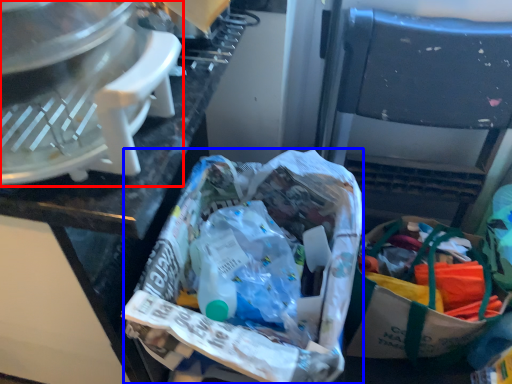
Question: Which of the following is the closest to the observer, kitchen appliance (highlighted by a red box) or material (highlighted by a blue box)?

Choices:
 (A) kitchen appliance
 (B) material

Answer: (A)